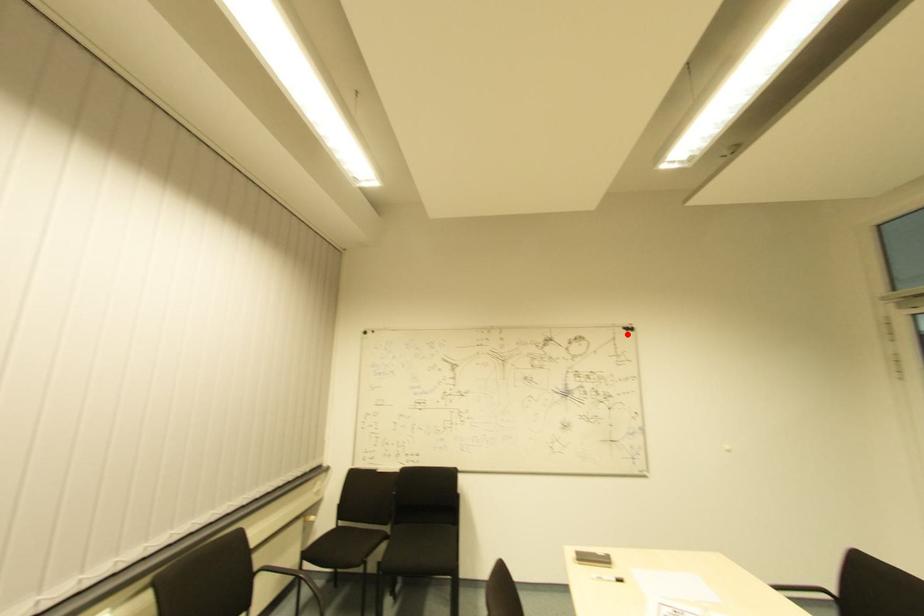
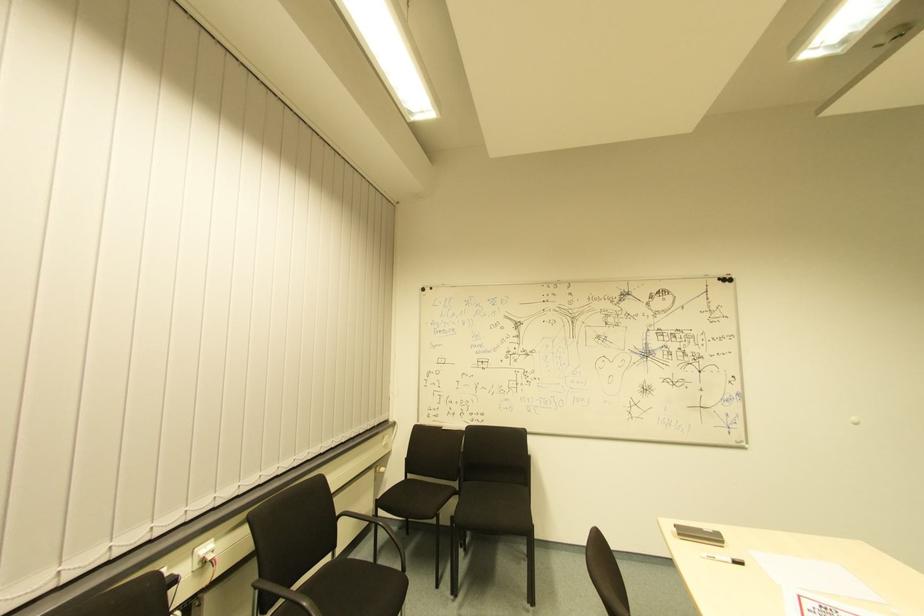
In the second image, find the point that corresponds to the highlighted location in the first image.

(725, 286)